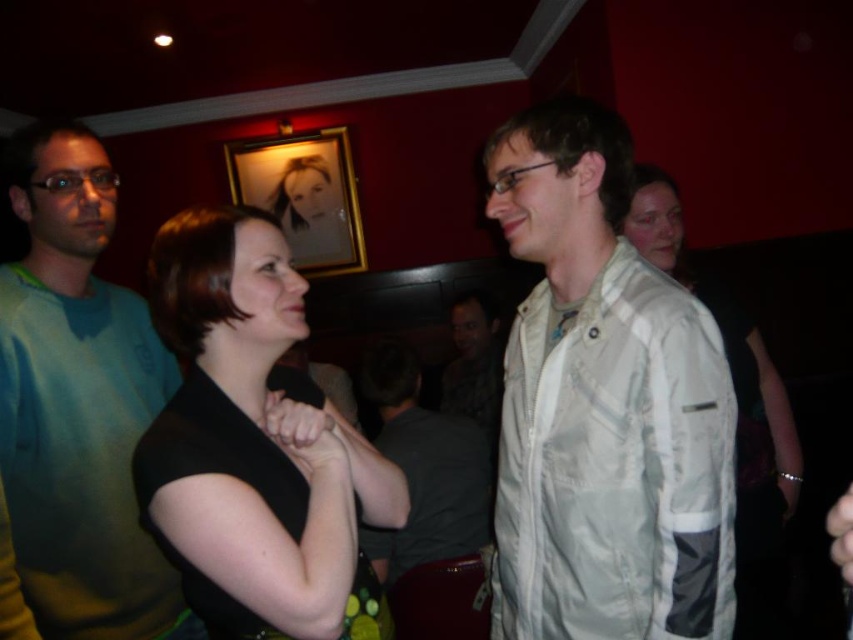
Is light gray fabric jacket at center closer to camera compared to teal fleece sweater at left?

Yes.

Which of these two, light gray fabric jacket at center or teal fleece sweater at left, stands shorter?

With less height is teal fleece sweater at left.

Does point (561, 224) come in front of point (44, 225)?

That is True.

Image resolution: width=853 pixels, height=640 pixels. I want to click on light gray fabric jacket at center, so click(x=602, y=404).

Can you confirm if light gray fabric jacket at center is positioned to the right of camouflage jacket at center?

Incorrect, light gray fabric jacket at center is not on the right side of camouflage jacket at center.

Does light gray fabric jacket at center have a greater width compared to camouflage jacket at center?

No.

Is point (708, 621) behind point (772, 508)?

No, it is in front of (772, 508).

At what (x,y) coordinates should I click in order to perform the action: click on light gray fabric jacket at center. Please return your answer as a coordinate pair (x, y). This screenshot has height=640, width=853. Looking at the image, I should click on (602, 404).

Between light gray fabric jacket at center and light beige fabric shirt at center, which one is positioned higher?

Positioned higher is light gray fabric jacket at center.

Locate an element on the screen. The width and height of the screenshot is (853, 640). light gray fabric jacket at center is located at coordinates (602, 404).